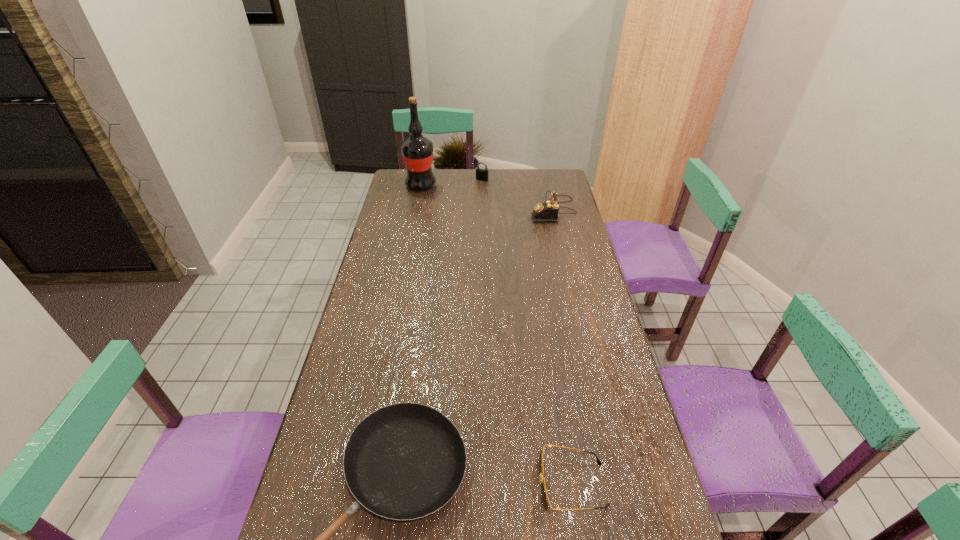
Where is `the tallest object`? Image resolution: width=960 pixels, height=540 pixels. the tallest object is located at coordinates (x=417, y=151).

What are the coordinates of `telephone` in the screenshot? It's located at (548, 211).

The image size is (960, 540). What are the coordinates of `the fourth shortest object` in the screenshot? It's located at (548, 211).

Where is `the third object from right to left`? This screenshot has width=960, height=540. the third object from right to left is located at coordinates (481, 174).

Locate an element on the screen. padlock is located at coordinates (481, 174).

The height and width of the screenshot is (540, 960). What are the coordinates of `sunglasses` in the screenshot? It's located at (545, 499).

This screenshot has height=540, width=960. Identify the location of vacant area situated on the front of the tallest object. (418, 202).

This screenshot has width=960, height=540. I want to click on vacant space located on the dial of the telephone, so click(503, 210).

You are a GUI agent. You are given a task and a screenshot of the screen. Output one action in this format:
    pyautogui.click(x=<x>, y=<y>)
    Task: Click on the vacant space located on the dial of the telephone
    The width and height of the screenshot is (960, 540).
    Given the screenshot: What is the action you would take?
    pyautogui.click(x=506, y=210)

This screenshot has width=960, height=540. I want to click on vacant space located 0.160m on the dial of the telephone, so click(x=494, y=210).